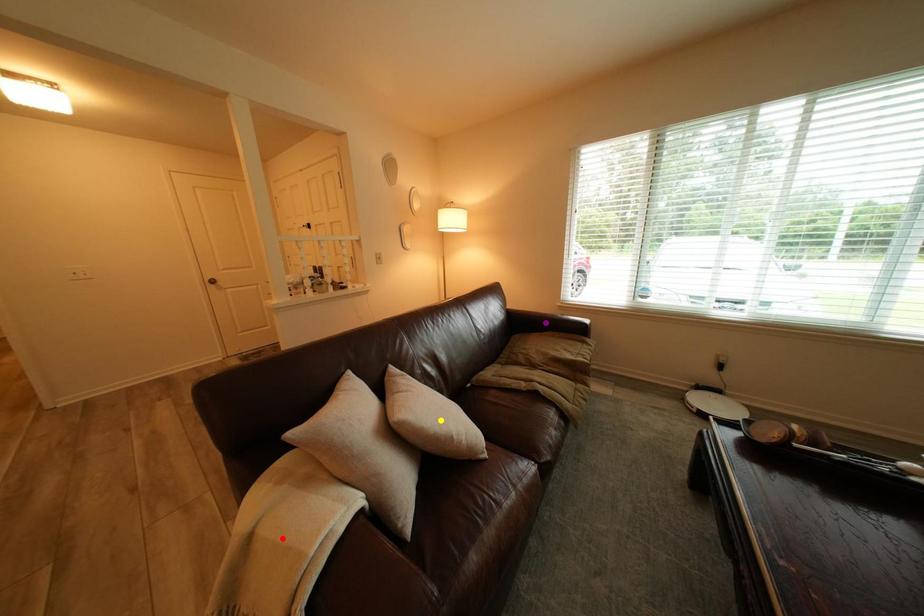
Order these from farthest to nearest:
- yellow point
- red point
- purple point

1. purple point
2. yellow point
3. red point